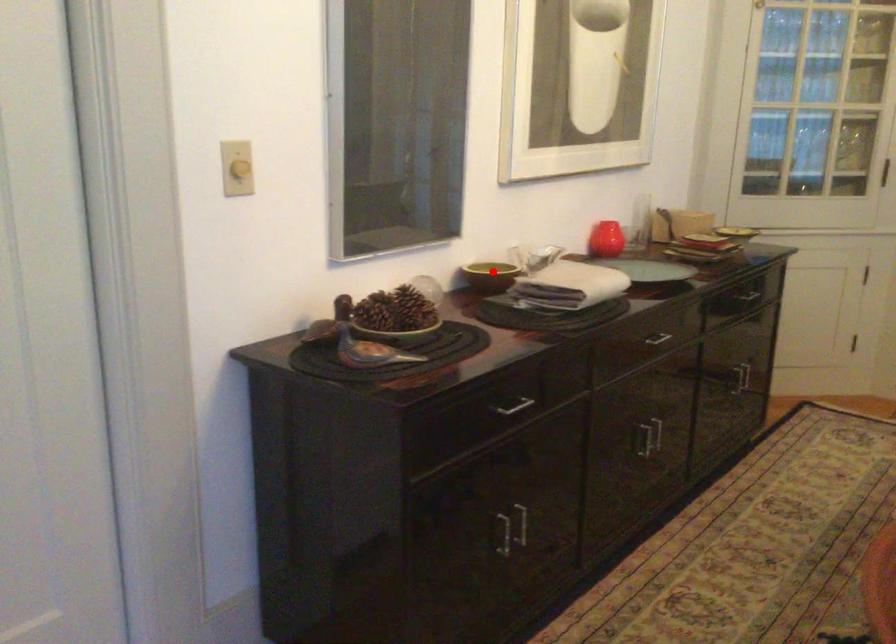
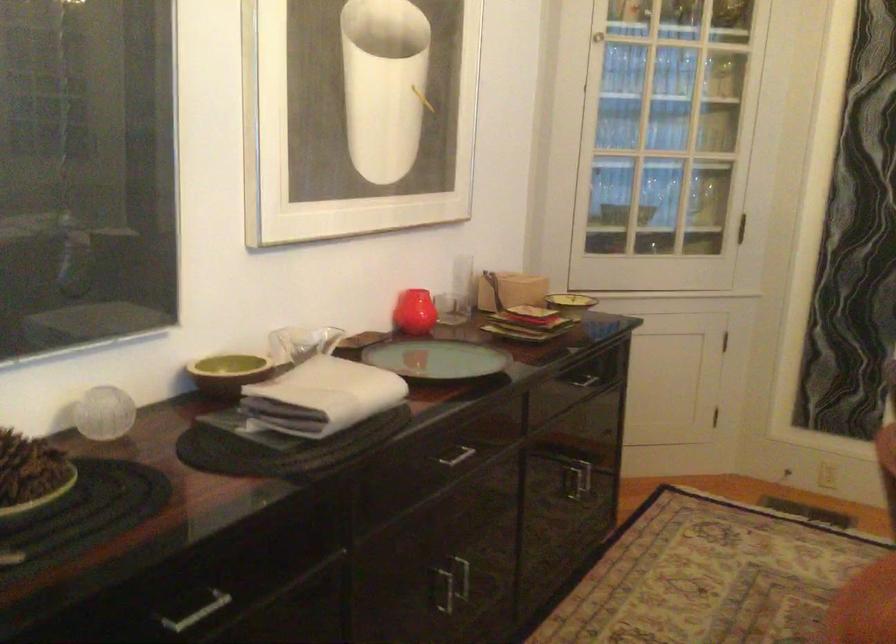
Question: I am providing you with two images of the same scene from different viewpoints. A red point is shown in image1. For the corresponding object point in image2, is it positioned nearer or farther from the camera?

Choices:
 (A) Nearer
 (B) Farther

Answer: (A)